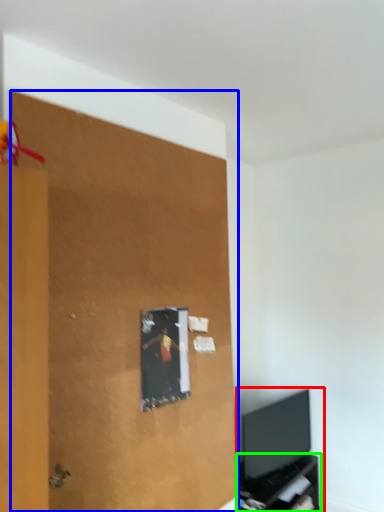
Question: Which is farther away from entertainment center (highlighted by a red box)? plywood (highlighted by a blue box) or tv cabinet (highlighted by a green box)?

Choices:
 (A) plywood
 (B) tv cabinet

Answer: (A)